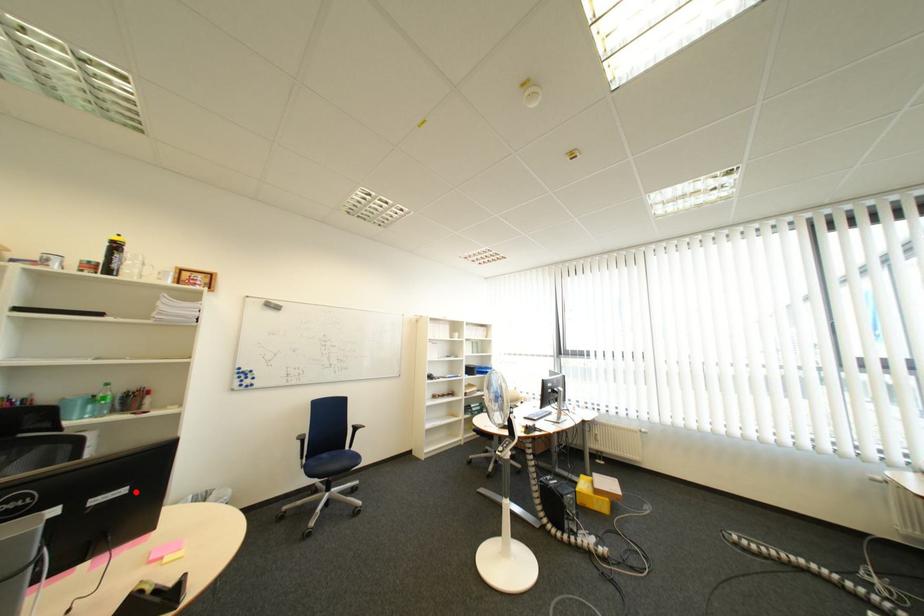
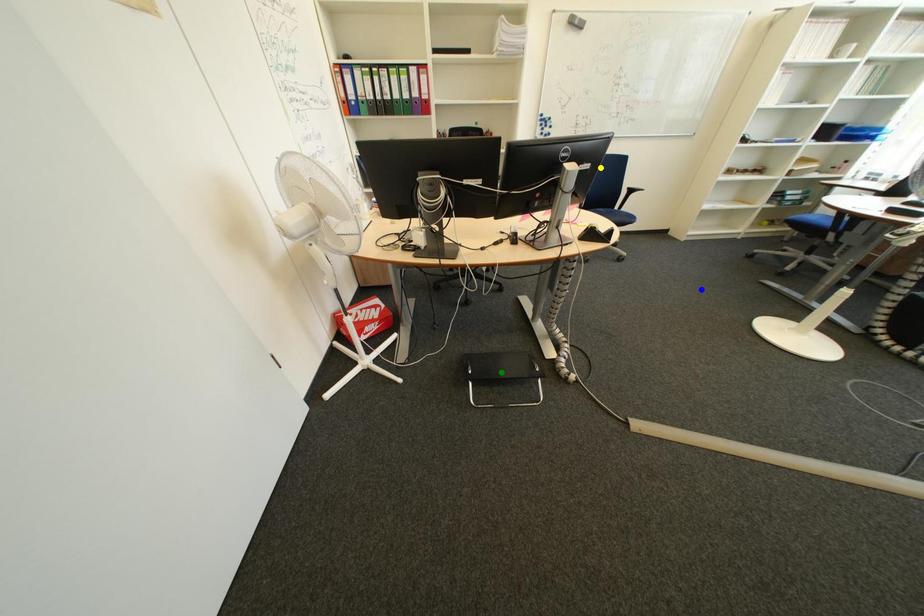
Question: I am providing you with two images of the same scene from different viewpoints. A red point is marked on the first image. You are given multiple points on the second image. Which point in image 2 represents the same 3d spot as the red point in image 1?

Choices:
 (A) yellow point
 (B) green point
 (C) blue point

Answer: (A)